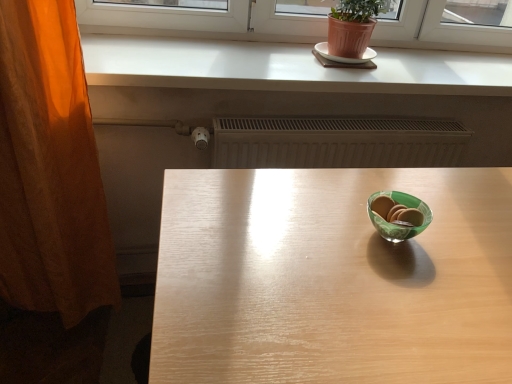
Question: From a real-world perspective, is orange fabric curtain at left located higher than white ceramic plate at upper center?

Choices:
 (A) no
 (B) yes

Answer: (A)

Question: Is orange fabric curtain at left to the right of white ceramic plate at upper center from the viewer's perspective?

Choices:
 (A) no
 (B) yes

Answer: (A)

Question: Considering the relative positions of orange fabric curtain at left and white ceramic plate at upper center in the image provided, is orange fabric curtain at left behind white ceramic plate at upper center?

Choices:
 (A) yes
 (B) no

Answer: (B)

Question: Is orange fabric curtain at left turned away from white ceramic plate at upper center?

Choices:
 (A) yes
 (B) no

Answer: (B)

Question: Can you see orange fabric curtain at left touching white ceramic plate at upper center?

Choices:
 (A) yes
 (B) no

Answer: (B)

Question: Does orange fabric curtain at left have a larger size compared to white ceramic plate at upper center?

Choices:
 (A) yes
 (B) no

Answer: (A)

Question: Does white matte counter top at upper center have a lesser width compared to white ceramic plate at upper center?

Choices:
 (A) yes
 (B) no

Answer: (B)

Question: From the image's perspective, does white matte counter top at upper center appear lower than white ceramic plate at upper center?

Choices:
 (A) no
 (B) yes

Answer: (B)

Question: Considering the relative sizes of white matte counter top at upper center and white ceramic plate at upper center in the image provided, is white matte counter top at upper center wider than white ceramic plate at upper center?

Choices:
 (A) no
 (B) yes

Answer: (B)

Question: Is white matte counter top at upper center looking in the opposite direction of white ceramic plate at upper center?

Choices:
 (A) yes
 (B) no

Answer: (B)

Question: From a real-world perspective, is white matte counter top at upper center over white ceramic plate at upper center?

Choices:
 (A) yes
 (B) no

Answer: (B)

Question: Is white matte counter top at upper center outside white ceramic plate at upper center?

Choices:
 (A) yes
 (B) no

Answer: (A)

Question: From a real-world perspective, is white matte counter top at upper center over orange fabric curtain at left?

Choices:
 (A) no
 (B) yes

Answer: (B)